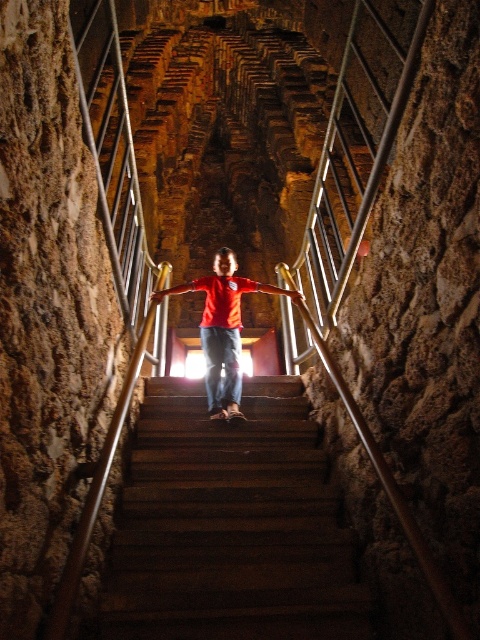
Question: Is wooden stairs at center positioned behind matte red shirt at center?

Choices:
 (A) no
 (B) yes

Answer: (A)

Question: Is wooden stairs at center thinner than matte red shirt at center?

Choices:
 (A) yes
 (B) no

Answer: (B)

Question: Which object is closer to the camera taking this photo?

Choices:
 (A) wooden stairs at center
 (B) matte red shirt at center

Answer: (A)

Question: Which point appears farthest from the camera in this image?

Choices:
 (A) (225, 288)
 (B) (229, 433)

Answer: (A)

Question: Does wooden stairs at center have a greater width compared to matte red shirt at center?

Choices:
 (A) no
 (B) yes

Answer: (B)